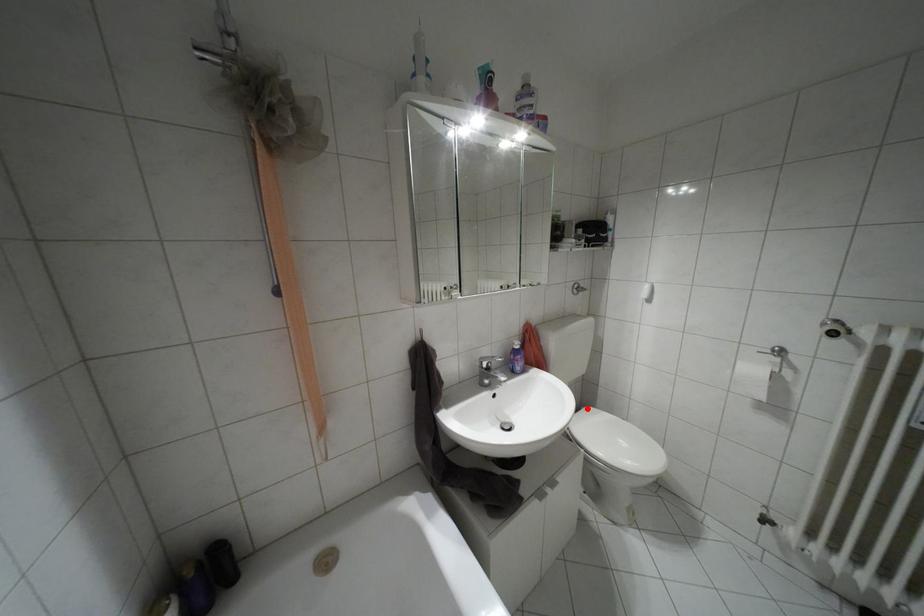
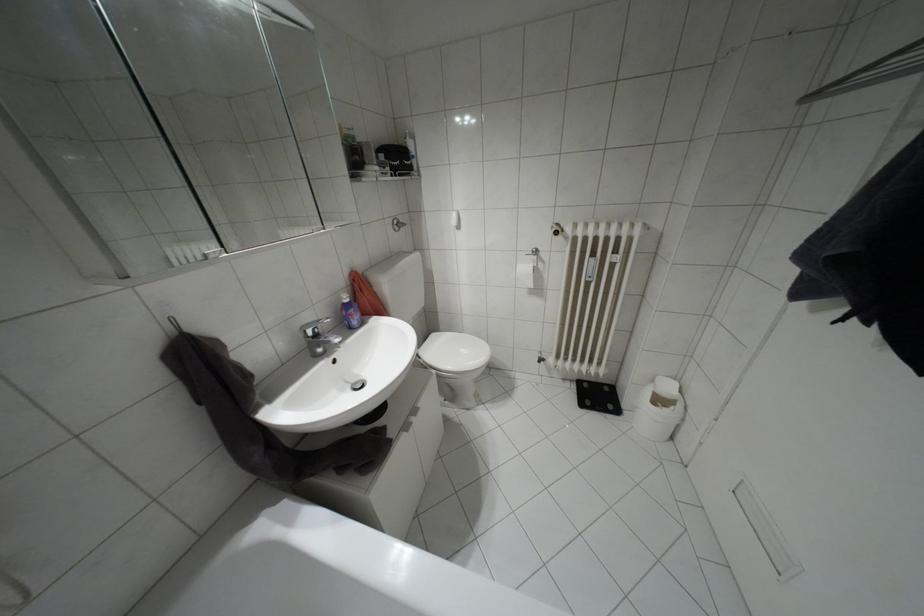
Locate, in the second image, the point that corresponds to the highlighted location in the first image.

(432, 334)